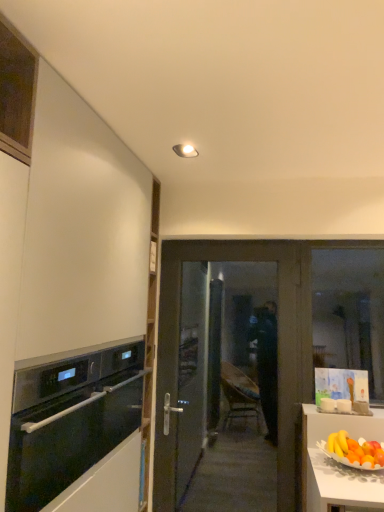
Question: From a real-world perspective, is matte dark brown door at center above or below transparent glass window at right?

Choices:
 (A) below
 (B) above

Answer: (A)

Question: Do you think matte dark brown door at center is within transparent glass window at right, or outside of it?

Choices:
 (A) inside
 (B) outside

Answer: (B)

Question: Which of these objects is positioned closest to the matte white ceiling light at upper center?

Choices:
 (A) transparent glass window at right
 (B) black glass oven at left
 (C) orange matte grapefruit at right
 (D) matte dark brown door at center

Answer: (D)

Question: Which object is the closest to the black glass oven at left?

Choices:
 (A) matte dark brown door at center
 (B) matte white ceiling light at upper center
 (C) orange matte grapefruit at right
 (D) transparent glass window at right

Answer: (A)